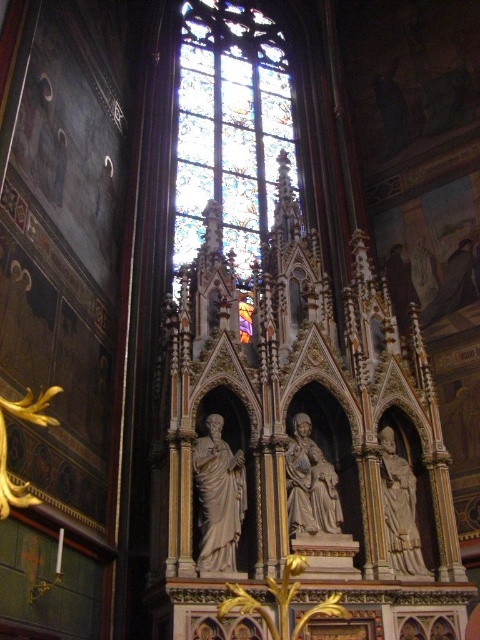
Question: Considering the real-world distances, which object is closest to the white marble statue at center?

Choices:
 (A) matte stone statue at center
 (B) stained glass window at center
 (C) white marble statue at right

Answer: (A)

Question: Based on their relative distances, which object is nearer to the stained glass window at center?

Choices:
 (A) white marble statue at center
 (B) matte stone statue at center
 (C) white marble statue at right

Answer: (B)

Question: Which point is closer to the camera?

Choices:
 (A) (323, 506)
 (B) (387, 474)
 (C) (241, 486)
 (D) (203, 227)

Answer: (C)

Question: Does stained glass window at center lie in front of white marble statue at center?

Choices:
 (A) no
 (B) yes

Answer: (A)

Question: Can you confirm if matte stone statue at center is wider than white marble statue at right?

Choices:
 (A) yes
 (B) no

Answer: (A)

Question: Is stained glass window at center wider than matte stone statue at center?

Choices:
 (A) yes
 (B) no

Answer: (A)